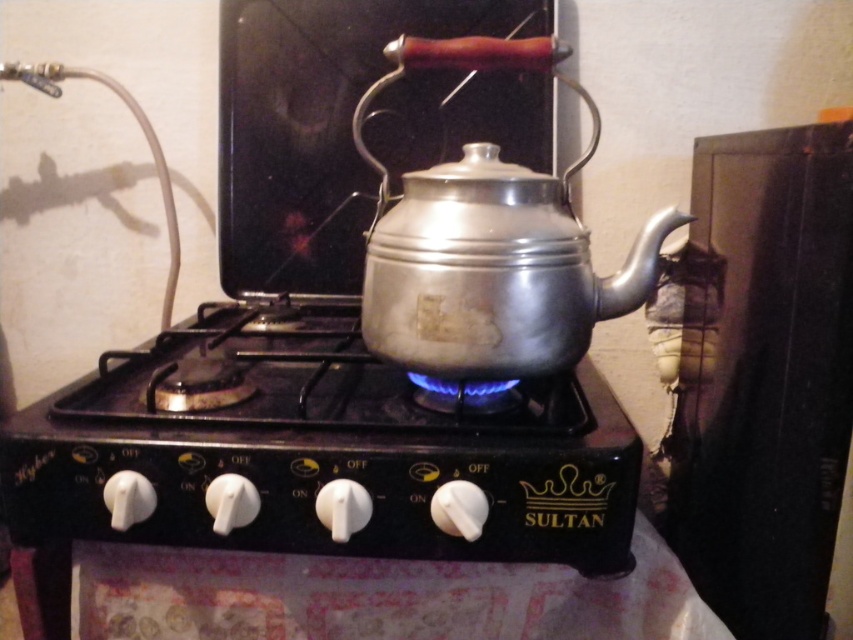
Question: Does silver metallic teapot at center lie in front of shiny metallic kettle at center?

Choices:
 (A) yes
 (B) no

Answer: (A)

Question: Which is nearer to the black matte stove at center?

Choices:
 (A) silver metallic teapot at center
 (B) shiny metallic kettle at center

Answer: (B)

Question: Among these points, which one is farthest from the camera?

Choices:
 (A) (113, 429)
 (B) (384, 198)

Answer: (B)

Question: Is silver metallic teapot at center thinner than shiny metallic kettle at center?

Choices:
 (A) yes
 (B) no

Answer: (A)

Question: Among these points, which one is farthest from the camera?

Choices:
 (A) pos(476,307)
 (B) pos(323,464)
 (C) pos(67,400)

Answer: (C)

Question: Is silver metallic teapot at center further to camera compared to shiny metallic kettle at center?

Choices:
 (A) no
 (B) yes

Answer: (A)